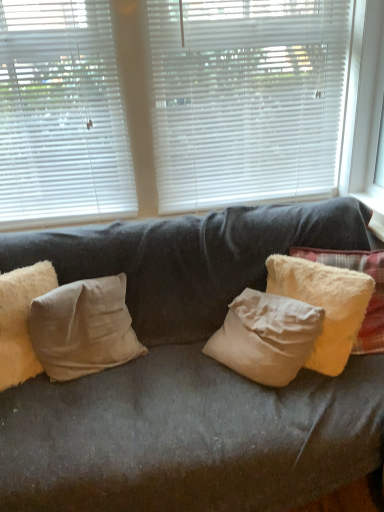
Question: Is white plastic window frame at upper right turned away from white matte blinds at upper left, the 1th window blind when ordered from left to right?

Choices:
 (A) yes
 (B) no

Answer: (B)

Question: From a real-world perspective, is white plastic window frame at upper right positioned over white matte blinds at upper left, which is counted as the second window blind, starting from the right, based on gravity?

Choices:
 (A) no
 (B) yes

Answer: (A)

Question: Is white plastic window frame at upper right to the right of white matte blinds at upper left, which is counted as the second window blind, starting from the right, from the viewer's perspective?

Choices:
 (A) no
 (B) yes

Answer: (B)

Question: Considering the relative sizes of white plastic window frame at upper right and white matte blinds at upper left, which is counted as the second window blind, starting from the right, in the image provided, is white plastic window frame at upper right taller than white matte blinds at upper left, which is counted as the second window blind, starting from the right,?

Choices:
 (A) yes
 (B) no

Answer: (B)

Question: Can you confirm if white plastic window frame at upper right is bigger than white matte blinds at upper left, which is counted as the second window blind, starting from the right?

Choices:
 (A) no
 (B) yes

Answer: (B)

Question: From the image's perspective, relative to white matte blinds at upper center, positioned as the 2th window blind in left-to-right order, is beige cotton pillow at left, the 3th pillow viewed from the right, above or below?

Choices:
 (A) below
 (B) above

Answer: (A)

Question: From their relative heights in the image, would you say beige cotton pillow at left, the 3th pillow viewed from the right, is taller or shorter than white matte blinds at upper center, which is counted as the first window blind, starting from the right?

Choices:
 (A) tall
 (B) short

Answer: (B)

Question: Considering the positions of point (39, 266) and point (162, 77), is point (39, 266) closer or farther from the camera than point (162, 77)?

Choices:
 (A) closer
 (B) farther

Answer: (A)

Question: Considering the positions of beige cotton pillow at left, the 3th pillow viewed from the right, and white matte blinds at upper center, positioned as the 2th window blind in left-to-right order, in the image, is beige cotton pillow at left, the 3th pillow viewed from the right, bigger or smaller than white matte blinds at upper center, positioned as the 2th window blind in left-to-right order,?

Choices:
 (A) small
 (B) big

Answer: (A)

Question: Based on their positions, is white plastic window frame at upper right located to the left or right of white matte blinds at upper center, positioned as the 2th window blind in left-to-right order?

Choices:
 (A) left
 (B) right

Answer: (B)

Question: From the image's perspective, is white plastic window frame at upper right above or below white matte blinds at upper center, which is counted as the first window blind, starting from the right?

Choices:
 (A) above
 (B) below

Answer: (B)

Question: Does point (x=377, y=125) appear closer or farther from the camera than point (x=31, y=102)?

Choices:
 (A) closer
 (B) farther

Answer: (B)

Question: From a real-world perspective, relative to white matte blinds at upper center, positioned as the 2th window blind in left-to-right order, is white plastic window frame at upper right vertically above or below?

Choices:
 (A) below
 (B) above

Answer: (A)

Question: From a real-world perspective, is white matte blinds at upper left, which is counted as the second window blind, starting from the right, positioned above or below beige cotton pillow at left, positioned as the second pillow in right-to-left order?

Choices:
 (A) above
 (B) below

Answer: (A)

Question: Looking at their shapes, would you say white matte blinds at upper left, the 1th window blind when ordered from left to right, is wider or thinner than beige cotton pillow at left, positioned as the second pillow in right-to-left order?

Choices:
 (A) wide
 (B) thin

Answer: (B)